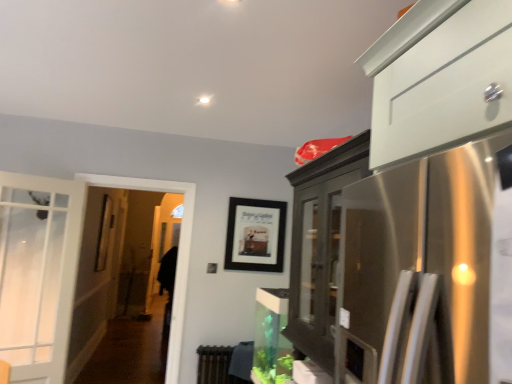
Question: Considering the positions of point (190, 187) and point (248, 208), is point (190, 187) closer or farther from the camera than point (248, 208)?

Choices:
 (A) closer
 (B) farther

Answer: (A)

Question: Is clear glass screen door at left in front of or behind black matte picture frame at center in the image?

Choices:
 (A) behind
 (B) front

Answer: (B)

Question: Which object is positioned closest to the black matte picture frame at center?

Choices:
 (A) clear glass screen door at left
 (B) brown textured radiator at lower center

Answer: (A)

Question: Based on their relative distances, which object is farther from the clear glass screen door at left?

Choices:
 (A) brown textured radiator at lower center
 (B) black matte picture frame at center

Answer: (B)